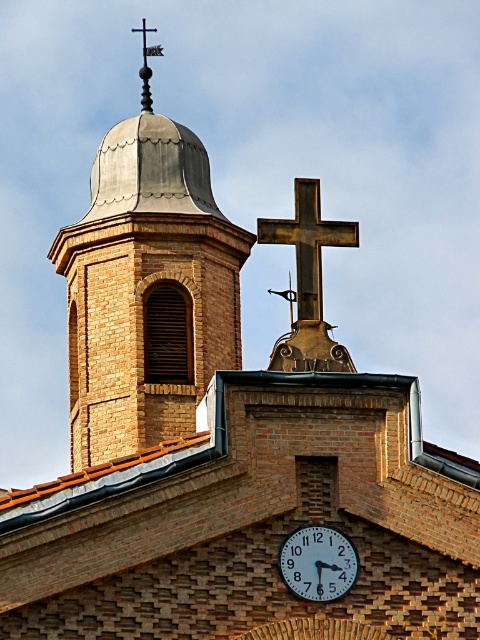
You are an architect inspecting the church facade. You need to determine which object occupies more horizontal space between the gray metallic dome at upper center and the white glossy clock at center. Which one is wider?

The gray metallic dome at upper center is wider than the white glossy clock at center according to the description.

You are an architect designing a new church and want to place a new decorative element exactly 0.2 units to the right of the dark brown wooden cross at center. According to the current design, where should you place the new element?

The new decorative element should be placed at point 0.381 plus 0.2 equals 0.581 in the x coordinate and 0.642 in the y coordinate, so the coordinates are approximately (308,371).

You are standing in front of the church and want to locate both the dark brown wooden cross at center and the white glossy clock at center. Which one is positioned to the right side of the other?

The dark brown wooden cross at center is to the right of the white glossy clock at center.